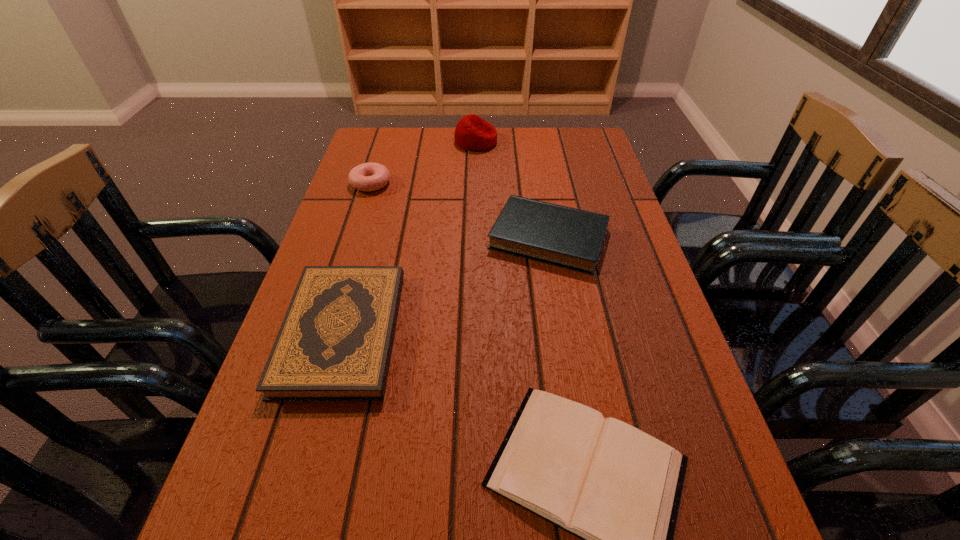
Where is `vacant space that satisfies the following two spatial constraints: 1. on the seat area of the tallest object; 2. on the left side of the farthest hardback book`? vacant space that satisfies the following two spatial constraints: 1. on the seat area of the tallest object; 2. on the left side of the farthest hardback book is located at coordinates (474, 238).

The width and height of the screenshot is (960, 540). I want to click on vacant position in the image that satisfies the following two spatial constraints: 1. on the seat area of the beanbag; 2. on the left side of the third farthest object, so pyautogui.click(x=474, y=238).

Identify the location of free location that satisfies the following two spatial constraints: 1. on the back side of the leftmost hardback book; 2. on the left side of the third farthest object. This screenshot has width=960, height=540. (369, 238).